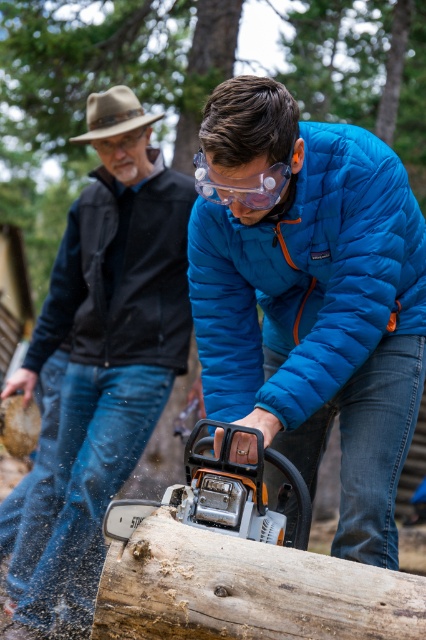
Question: Among these points, which one is nearest to the camera?

Choices:
 (A) (347, 262)
 (B) (218, 609)
 (C) (262, 202)

Answer: (B)

Question: Can you confirm if matte black jacket at left is positioned above blue quilted jacket at center?

Choices:
 (A) yes
 (B) no

Answer: (B)

Question: Among these points, which one is farthest from the camera?

Choices:
 (A) click(x=233, y=188)
 (B) click(x=209, y=356)
 (C) click(x=69, y=323)

Answer: (C)

Question: Estimate the real-world distances between objects in this image. Which object is closer to the blue quilted jacket at center?

Choices:
 (A) wooden log at center
 (B) clear plastic goggles at center

Answer: (B)

Question: Does blue quilted jacket at center have a lesser width compared to clear plastic goggles at center?

Choices:
 (A) no
 (B) yes

Answer: (A)

Question: Does blue quilted jacket at center appear under wooden log at center?

Choices:
 (A) yes
 (B) no

Answer: (B)